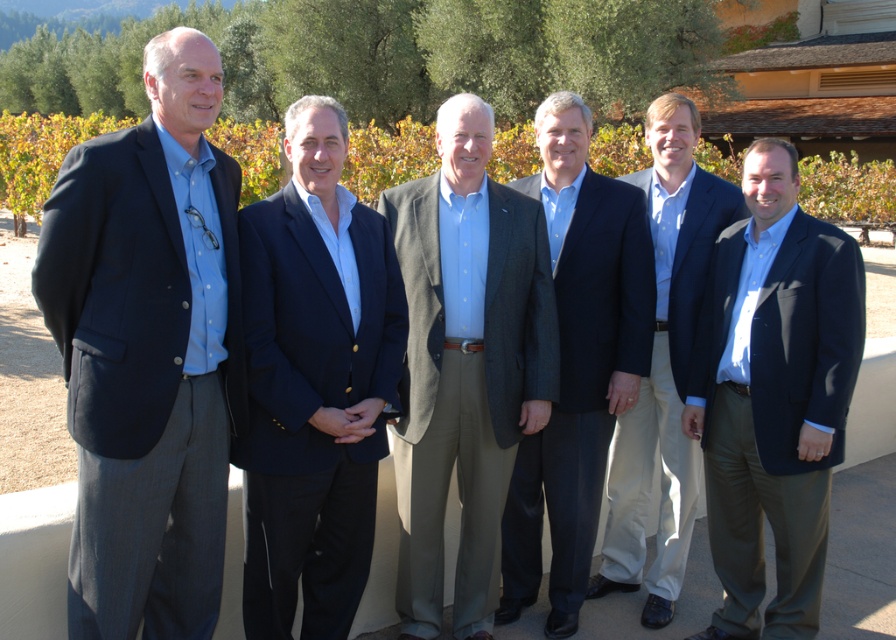
Question: Does dark blue suit at center appear on the right side of matte blue suit at center?

Choices:
 (A) no
 (B) yes

Answer: (A)

Question: Which object appears farthest from the camera in this image?

Choices:
 (A) matte blue suit at center
 (B) light brown textured blazer at center
 (C) navy blue suit at center
 (D) matte blue shirt at left

Answer: (A)

Question: In this image, where is light brown textured blazer at center located relative to matte blue suit at center?

Choices:
 (A) left
 (B) right

Answer: (A)

Question: In this image, where is matte blue shirt at left located relative to dark blue suit at center?

Choices:
 (A) left
 (B) right

Answer: (A)

Question: Estimate the real-world distances between objects in this image. Which object is farther from the matte blue shirt at left?

Choices:
 (A) matte blue suit at center
 (B) dark blue suit at center

Answer: (A)

Question: Which of the following is the closest to the observer?

Choices:
 (A) (286, 483)
 (B) (791, 188)

Answer: (A)